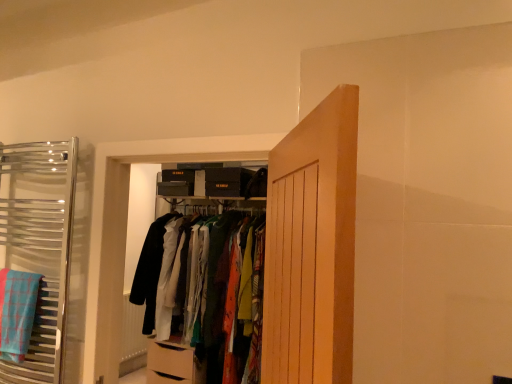
Question: Is matte fabric clothes at center, which appears as the 1th closet when viewed from the back, not close to blue plaid bath towel at left?

Choices:
 (A) yes
 (B) no

Answer: (A)

Question: Does matte fabric clothes at center, the 2th closet when ordered from front to back, appear on the left side of blue plaid bath towel at left?

Choices:
 (A) no
 (B) yes

Answer: (A)

Question: Considering the relative sizes of matte fabric clothes at center, which appears as the 1th closet when viewed from the back, and blue plaid bath towel at left in the image provided, is matte fabric clothes at center, which appears as the 1th closet when viewed from the back, bigger than blue plaid bath towel at left?

Choices:
 (A) no
 (B) yes

Answer: (B)

Question: Does matte fabric clothes at center, which is counted as the 1th closet, starting from the right, lie in front of blue plaid bath towel at left?

Choices:
 (A) no
 (B) yes

Answer: (A)

Question: Can you confirm if matte fabric clothes at center, the 2th closet when ordered from front to back, is smaller than blue plaid bath towel at left?

Choices:
 (A) no
 (B) yes

Answer: (A)

Question: From a real-world perspective, is matte fabric clothes at center, which appears as the 1th closet when viewed from the back, positioned under blue plaid bath towel at left based on gravity?

Choices:
 (A) yes
 (B) no

Answer: (A)

Question: Is blue plaid bath towel at left not inside wooden door at center?

Choices:
 (A) yes
 (B) no

Answer: (A)

Question: From a real-world perspective, is blue plaid bath towel at left on wooden door at center?

Choices:
 (A) yes
 (B) no

Answer: (B)

Question: Is blue plaid bath towel at left looking in the opposite direction of wooden door at center?

Choices:
 (A) no
 (B) yes

Answer: (A)

Question: Would you say wooden door at center is part of blue plaid bath towel at left's contents?

Choices:
 (A) no
 (B) yes

Answer: (A)

Question: Are blue plaid bath towel at left and wooden door at center far apart?

Choices:
 (A) no
 (B) yes

Answer: (B)

Question: Is blue plaid bath towel at left taller than wooden door at center?

Choices:
 (A) no
 (B) yes

Answer: (A)

Question: Is matte fabric clothes at center, which is counted as the 1th closet, starting from the right, at the left side of chrome towel rack at left, acting as the second closet starting from the back?

Choices:
 (A) yes
 (B) no

Answer: (B)